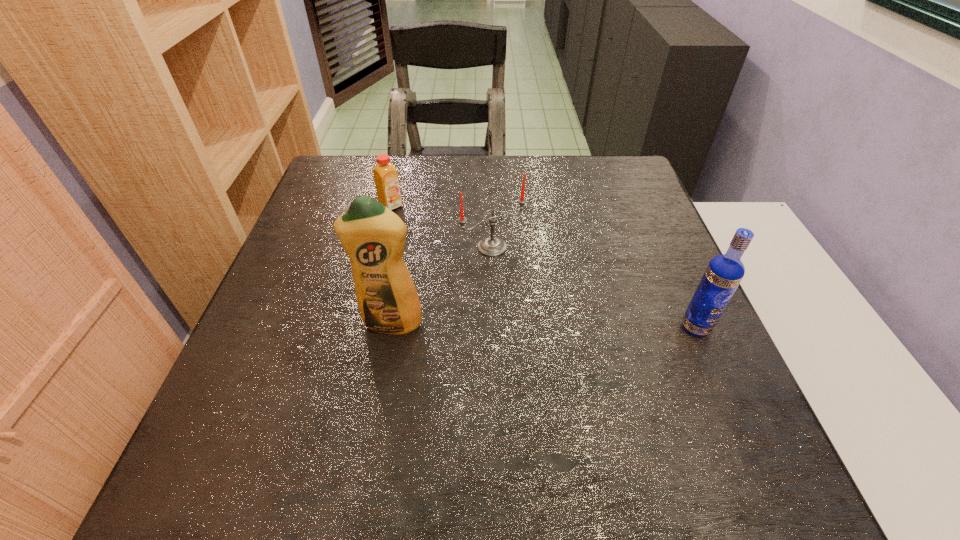
The width and height of the screenshot is (960, 540). I want to click on free space located on the front and back of the farthest object, so click(457, 258).

Identify the location of vacant area situated 0.280m on the front and back of the farthest object. The height and width of the screenshot is (540, 960). (468, 267).

At what (x,y) coordinates should I click in order to perform the action: click on vacant space positioned 0.320m on the front-facing side of the second shortest object. Please return your answer as a coordinate pair (x, y). The image size is (960, 540). Looking at the image, I should click on (599, 360).

Identify the location of vacant space located on the front-facing side of the second shortest object. This screenshot has width=960, height=540. (629, 394).

You are a GUI agent. You are given a task and a screenshot of the screen. Output one action in this format:
    pyautogui.click(x=<x>, y=<y>)
    Task: Click on the blank area located 0.350m on the front-facing side of the second shortest object
    The height and width of the screenshot is (540, 960).
    Given the screenshot: What is the action you would take?
    pyautogui.click(x=610, y=373)

In order to click on object at the far edge in this screenshot , I will do `click(386, 178)`.

At what (x,y) coordinates should I click in order to perform the action: click on object positioned at the right edge. Please return your answer as a coordinate pair (x, y). The image size is (960, 540). Looking at the image, I should click on (724, 272).

Locate an element on the screen. blank space at the far edge of the desktop is located at coordinates (581, 191).

Locate an element on the screen. This screenshot has height=540, width=960. free spot at the near edge of the desktop is located at coordinates (572, 417).

Where is `vacant space at the left edge of the desktop`? vacant space at the left edge of the desktop is located at coordinates (281, 313).